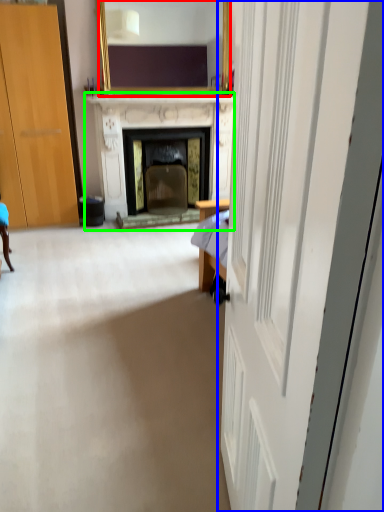
Question: Which object is the farthest from mirror (highlighted by a red box)? Choose among these: door (highlighted by a blue box) or fireplace (highlighted by a green box).

Choices:
 (A) door
 (B) fireplace

Answer: (A)